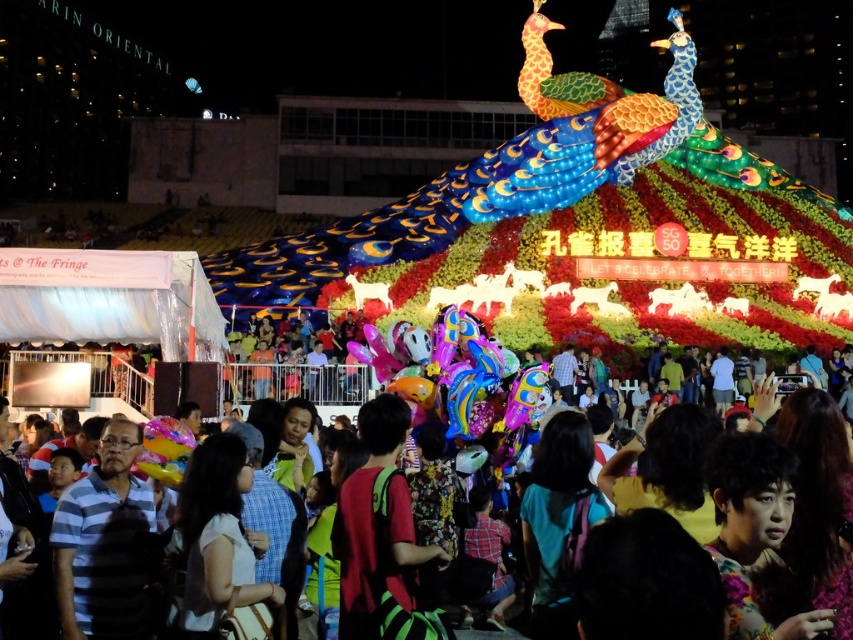
You are at the SG 50 celebration and want to take a photo of the peacock display. You have two options for where to stand to get the best shot. One is at point (117, 572) and the other is at point (257, 358). Which point is closer to the peacock display?

Point (117, 572) is in front of point (257, 358), so it is closer to the peacock display.

You are standing at the center of the scene and want to find the striped cotton shirt at lower left. In which direction should you look to locate it?

The striped cotton shirt at lower left is located at point [103,544], which is to the lower left direction from your current position at the center of the scene.